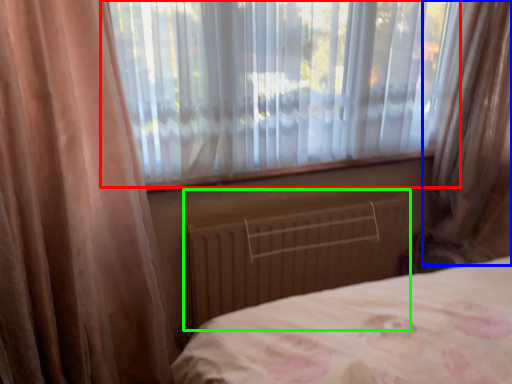
Question: Which object is the closest to the window (highlighted by a red box)? Choose among these: curtain (highlighted by a blue box) or radiator (highlighted by a green box).

Choices:
 (A) curtain
 (B) radiator

Answer: (B)